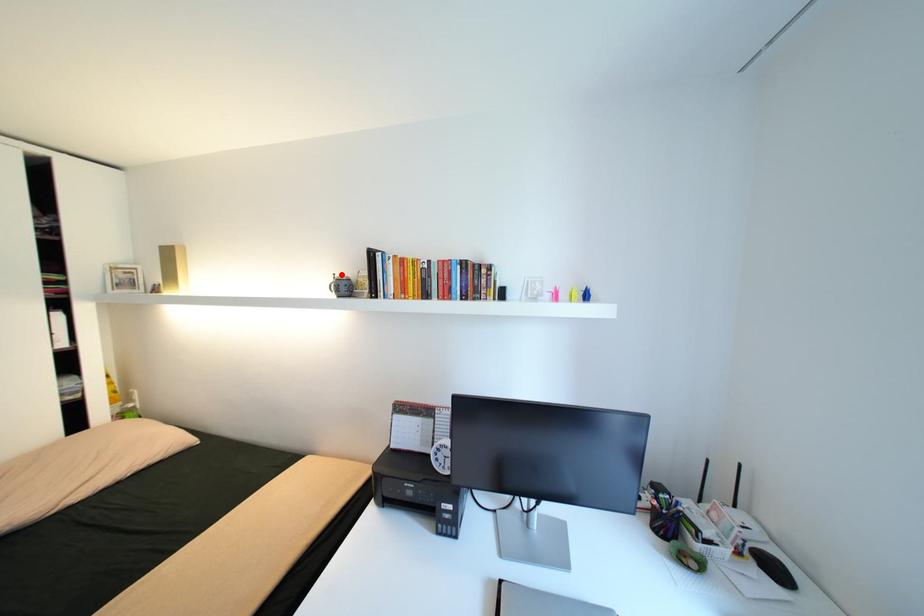
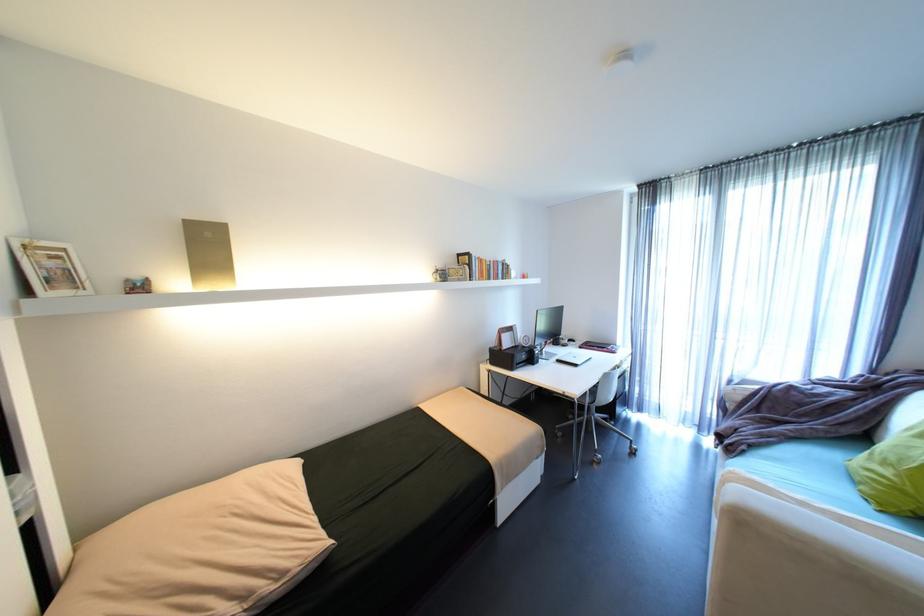
The point at the highlighted location is marked in the first image. Where is the corresponding point in the second image?

(444, 267)